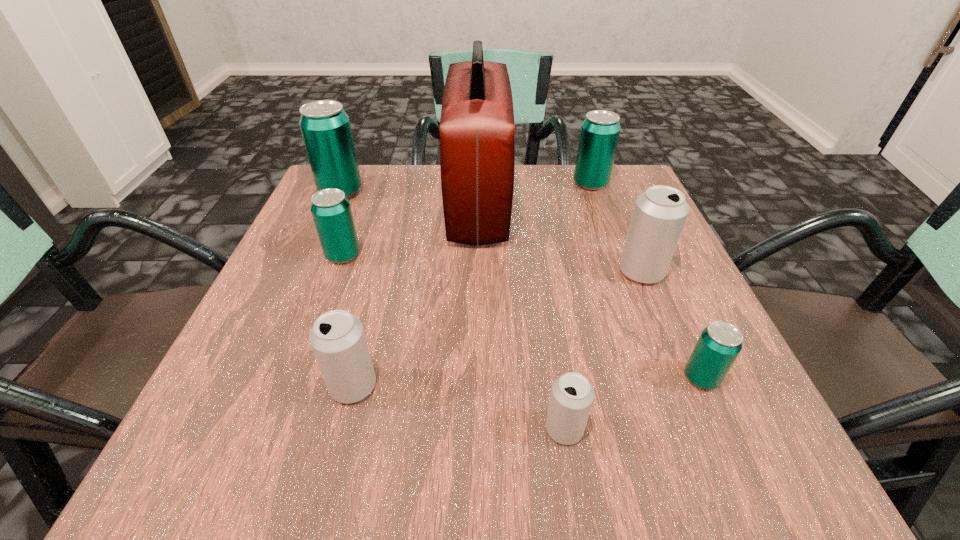
I want to click on vacant space positioned on the front of the smallest teal beer can, so click(x=735, y=454).

Where is `the first aid kit located in the far edge section of the desktop`? Image resolution: width=960 pixels, height=540 pixels. the first aid kit located in the far edge section of the desktop is located at coordinates (477, 130).

The width and height of the screenshot is (960, 540). In order to click on object located in the near edge section of the desktop in this screenshot , I will do `click(572, 395)`.

Where is `object positioned at the far left corner`? The height and width of the screenshot is (540, 960). object positioned at the far left corner is located at coordinates (325, 127).

Where is `object located in the far right corner section of the desktop`? The image size is (960, 540). object located in the far right corner section of the desktop is located at coordinates (599, 135).

In the image, there is a desktop. Where is `vacant space at the near edge`? vacant space at the near edge is located at coordinates (486, 448).

Where is `free region at the left edge`? free region at the left edge is located at coordinates (296, 260).

In the image, there is a desktop. Where is `vacant space at the right edge`? This screenshot has height=540, width=960. vacant space at the right edge is located at coordinates click(686, 330).

In the image, there is a desktop. Where is `free region at the far left corner`? The height and width of the screenshot is (540, 960). free region at the far left corner is located at coordinates (384, 184).

This screenshot has height=540, width=960. I want to click on free region at the far right corner of the desktop, so click(613, 204).